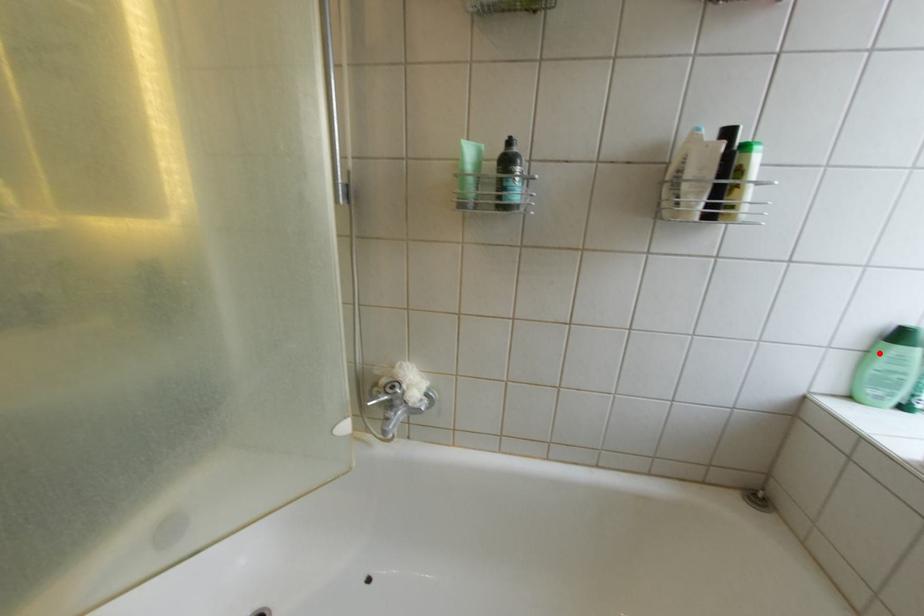
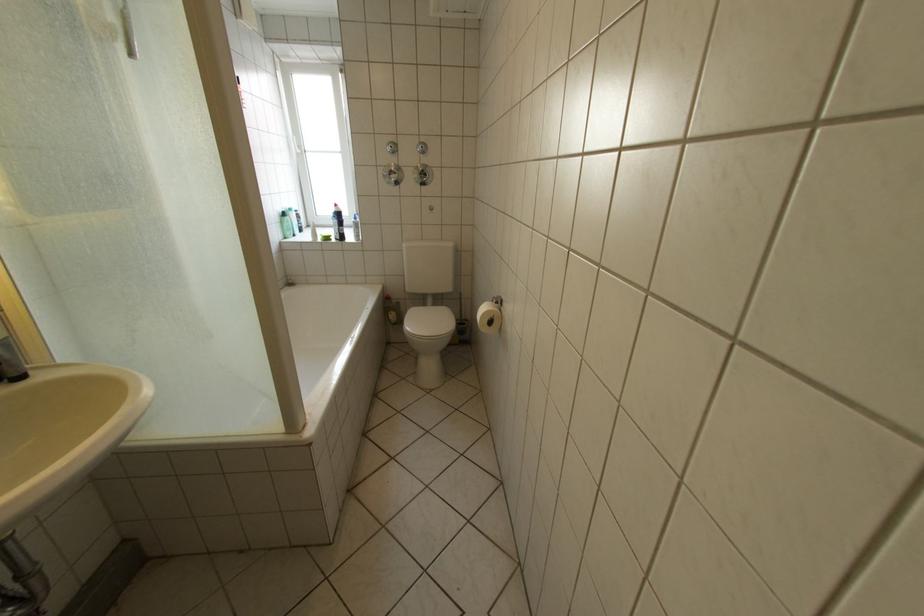
The point at the highlighted location is marked in the first image. Where is the corresponding point in the second image?

(294, 224)